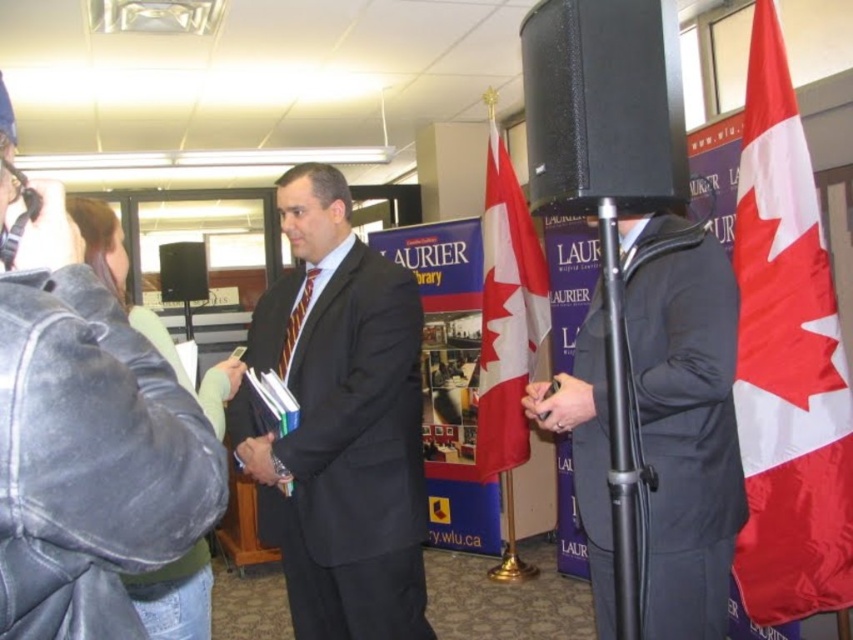
Question: Is red fabric flag at right to the right of black matte pole at center from the viewer's perspective?

Choices:
 (A) no
 (B) yes

Answer: (B)

Question: Among these objects, which one is farthest from the camera?

Choices:
 (A) denim jacket at left
 (B) black matte suit at center
 (C) matte black speaker at center

Answer: (C)

Question: Which object is closer to the camera taking this photo?

Choices:
 (A) black matte suit at center
 (B) denim jacket at left
 (C) black matte pole at center

Answer: (B)

Question: Which of the following is the farthest from the observer?

Choices:
 (A) [x=358, y=371]
 (B) [x=595, y=307]

Answer: (A)

Question: Does black matte suit at center appear under denim jacket at left?

Choices:
 (A) yes
 (B) no

Answer: (A)

Question: In this image, where is dark suit at center located relative to red fabric flag at center?

Choices:
 (A) below
 (B) above

Answer: (A)